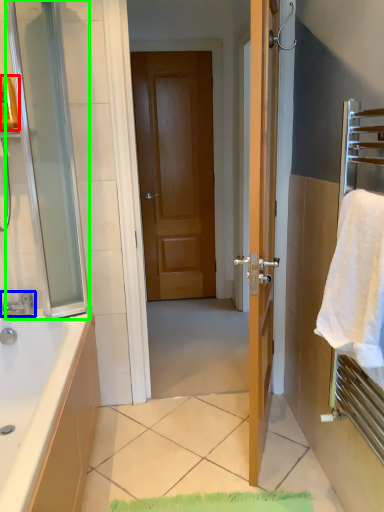
Question: Which object is positioned farthest from toiletry (highlighted by a red box)? Select from tap (highlighted by a blue box) and screen door (highlighted by a green box).

Choices:
 (A) tap
 (B) screen door

Answer: (A)